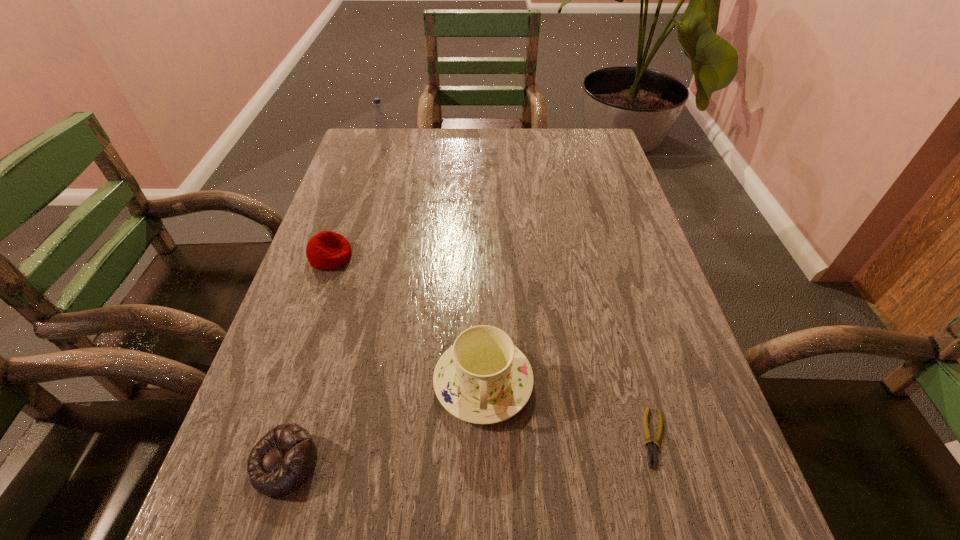
The width and height of the screenshot is (960, 540). I want to click on the farthest object, so click(379, 117).

You are a GUI agent. You are given a task and a screenshot of the screen. Output one action in this format:
    pyautogui.click(x=<x>, y=<y>)
    Task: Click on the tallest object
    This screenshot has height=540, width=960.
    Given the screenshot: What is the action you would take?
    pyautogui.click(x=379, y=117)

You are a GUI agent. You are given a task and a screenshot of the screen. Output one action in this format:
    pyautogui.click(x=<x>, y=<y>)
    Task: Click on the chinaware
    This screenshot has width=960, height=540.
    Given the screenshot: What is the action you would take?
    pyautogui.click(x=482, y=378)

The image size is (960, 540). Identify the location of the fourth object from left to right. (482, 378).

Locate an element on the screen. The width and height of the screenshot is (960, 540). the third tallest object is located at coordinates (326, 250).

This screenshot has width=960, height=540. Find the location of `the farther beanbag`. the farther beanbag is located at coordinates (326, 250).

At what (x,y) coordinates should I click in order to perform the action: click on the fourth tallest object. Please return your answer as a coordinate pair (x, y). This screenshot has height=540, width=960. Looking at the image, I should click on (284, 458).

Find the location of `the nearer beanbag`. the nearer beanbag is located at coordinates (284, 458).

You are a GUI agent. You are given a task and a screenshot of the screen. Output one action in this format:
    pyautogui.click(x=<x>, y=<y>)
    Task: Click on the shortest object
    
    Given the screenshot: What is the action you would take?
    pyautogui.click(x=652, y=450)

This screenshot has width=960, height=540. What are the coordinates of `pliers` in the screenshot? It's located at (652, 450).